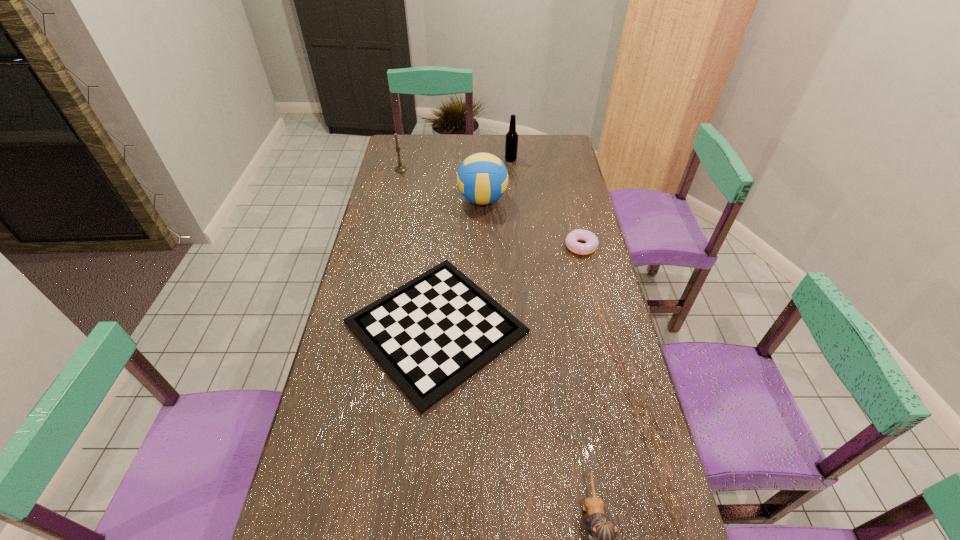
At what (x,y) coordinates should I click in order to perform the action: click on vacant space that satisfies the following two spatial constraints: 1. on the back side of the fourth nearest object; 2. on the right side of the farthest object. Please return your answer as a coordinate pair (x, y). The height and width of the screenshot is (540, 960). Looking at the image, I should click on (482, 159).